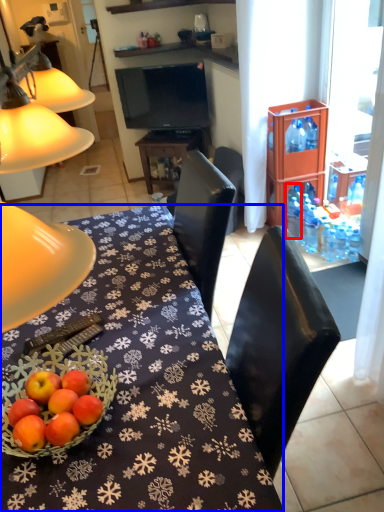
Question: Which point is further to the camera, bottle (highlighted by a red box) or desk (highlighted by a blue box)?

Choices:
 (A) bottle
 (B) desk

Answer: (A)